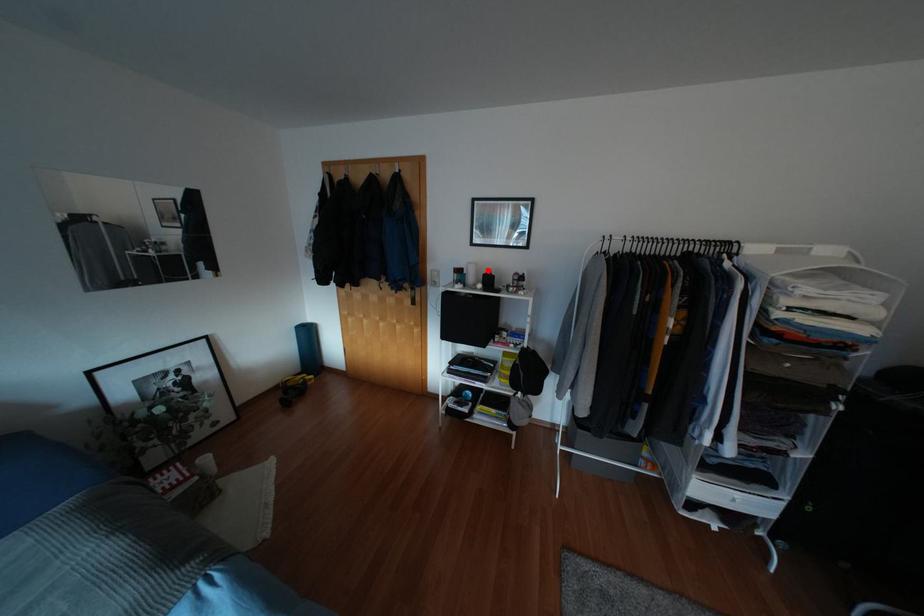
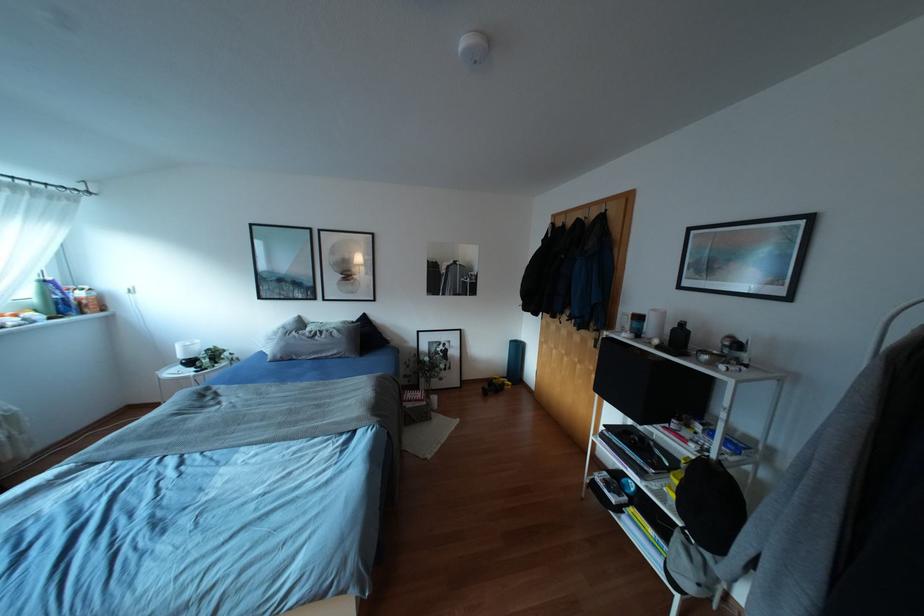
The point at the highlighted location is marked in the first image. Where is the corresponding point in the second image?

(682, 323)